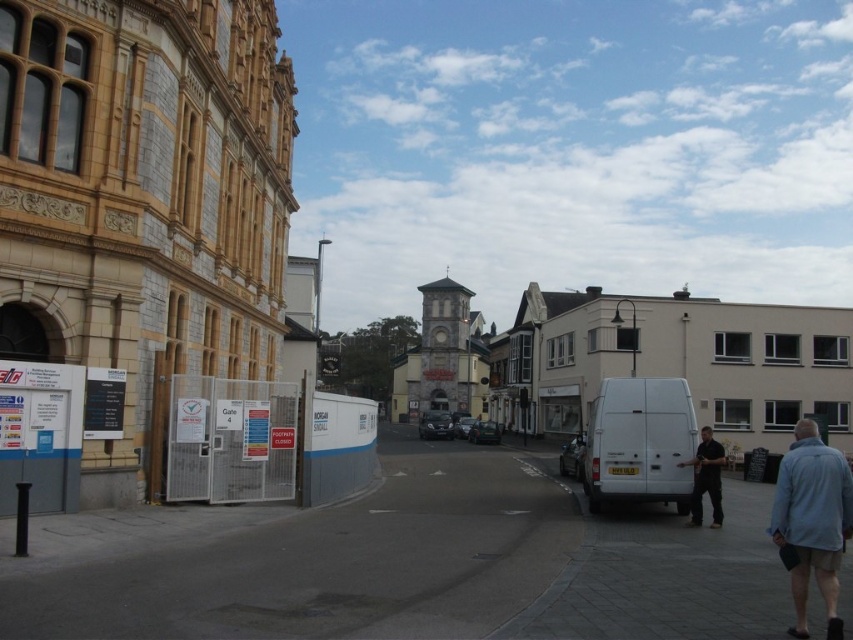
Question: Does blue denim jacket at lower right appear on the right side of black shirt at center?

Choices:
 (A) yes
 (B) no

Answer: (A)

Question: Does blue denim jacket at lower right appear on the left side of black shirt at center?

Choices:
 (A) yes
 (B) no

Answer: (B)

Question: Which of these objects is positioned closest to the blue denim jacket at lower right?

Choices:
 (A) black shirt at center
 (B) white matte van at center

Answer: (B)

Question: Among these objects, which one is nearest to the camera?

Choices:
 (A) white matte van at center
 (B) black shirt at center
 (C) blue denim jacket at lower right

Answer: (C)

Question: Is white matte van at center to the left of black shirt at center from the viewer's perspective?

Choices:
 (A) yes
 (B) no

Answer: (B)

Question: Which object is the farthest from the white matte van at center?

Choices:
 (A) black shirt at center
 (B) blue denim jacket at lower right

Answer: (B)